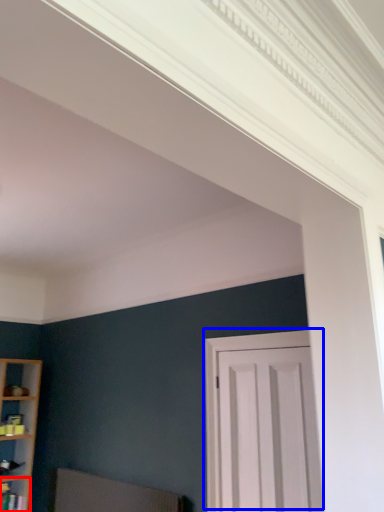
Question: Which point is further to the camera, shelf (highlighted by a red box) or door (highlighted by a blue box)?

Choices:
 (A) shelf
 (B) door

Answer: (A)